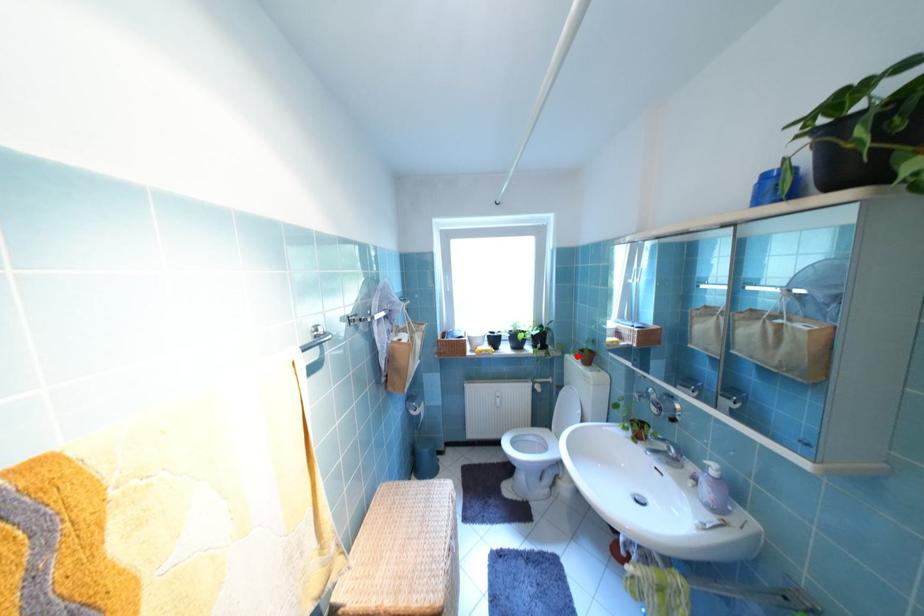
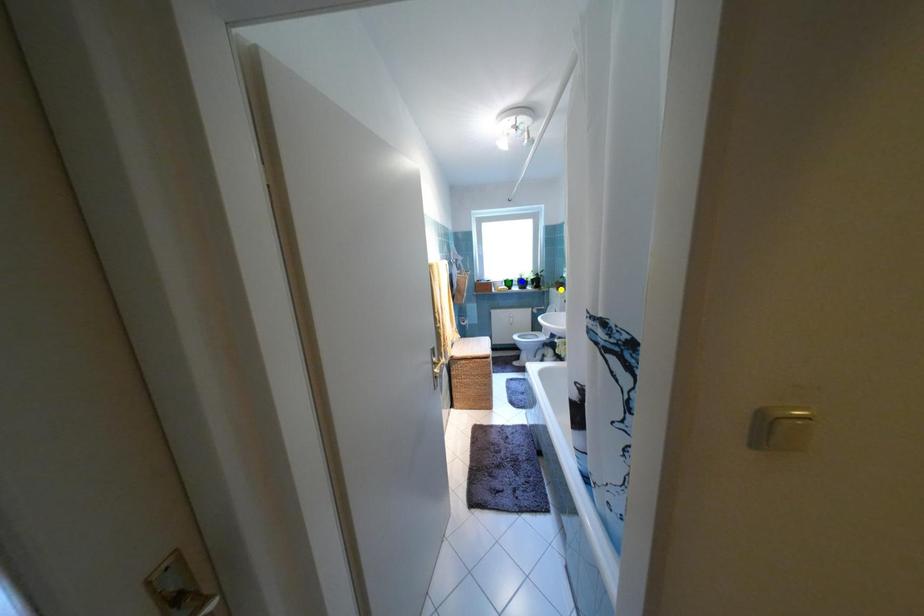
Question: I am providing you with two images of the same scene from different viewpoints. A red point is marked on the first image. You are given multiple points on the second image. Can you choose the point in image 2 that corresponds to the point in image 1?

Choices:
 (A) blue point
 (B) yellow point
 (C) green point

Answer: (B)